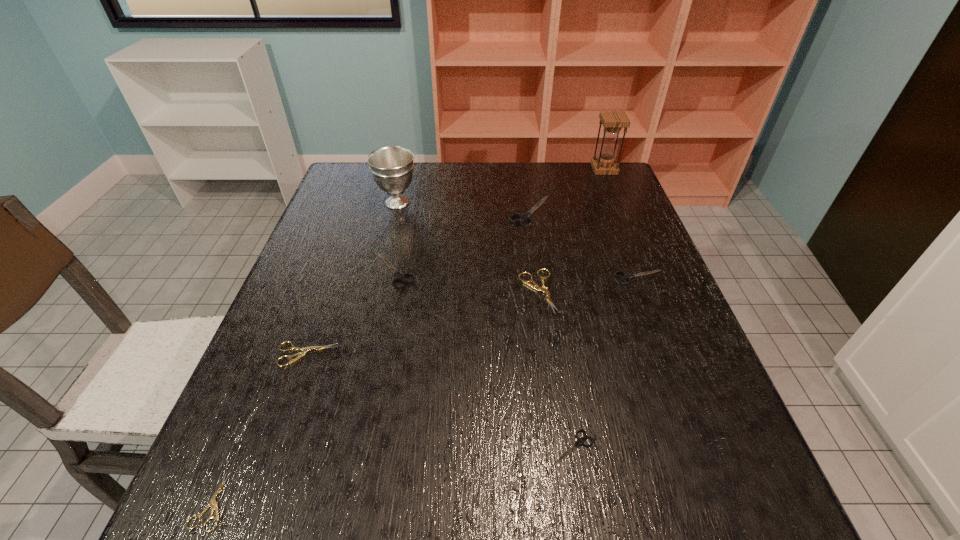
The height and width of the screenshot is (540, 960). Find the location of `vacant point located 0.130m on the back of the sixth shortest object`. vacant point located 0.130m on the back of the sixth shortest object is located at coordinates (405, 223).

This screenshot has width=960, height=540. What are the coordinates of `free space located 0.290m on the left of the third biggest black shears` in the screenshot? It's located at (495, 277).

Image resolution: width=960 pixels, height=540 pixels. In order to click on vacant space located on the front of the biggest beige shears in this screenshot , I will do `click(549, 375)`.

Where is `vacant space located on the right of the second biggest beige shears`? vacant space located on the right of the second biggest beige shears is located at coordinates (511, 355).

Where is `vacant region located on the left of the second nearest shears`? The height and width of the screenshot is (540, 960). vacant region located on the left of the second nearest shears is located at coordinates (375, 448).

At what (x,y) coordinates should I click in order to perform the action: click on blank space located on the back of the nearest beige shears. Please return your answer as a coordinate pair (x, y). Looking at the image, I should click on (259, 389).

The height and width of the screenshot is (540, 960). Find the location of `hourglass situated at the far edge`. hourglass situated at the far edge is located at coordinates (613, 121).

This screenshot has height=540, width=960. I want to click on chalice positioned at the far edge, so click(392, 167).

This screenshot has width=960, height=540. Identify the location of shears at the far edge. (524, 217).

Locate an element on the screen. The height and width of the screenshot is (540, 960). object that is at the near edge is located at coordinates (212, 502).